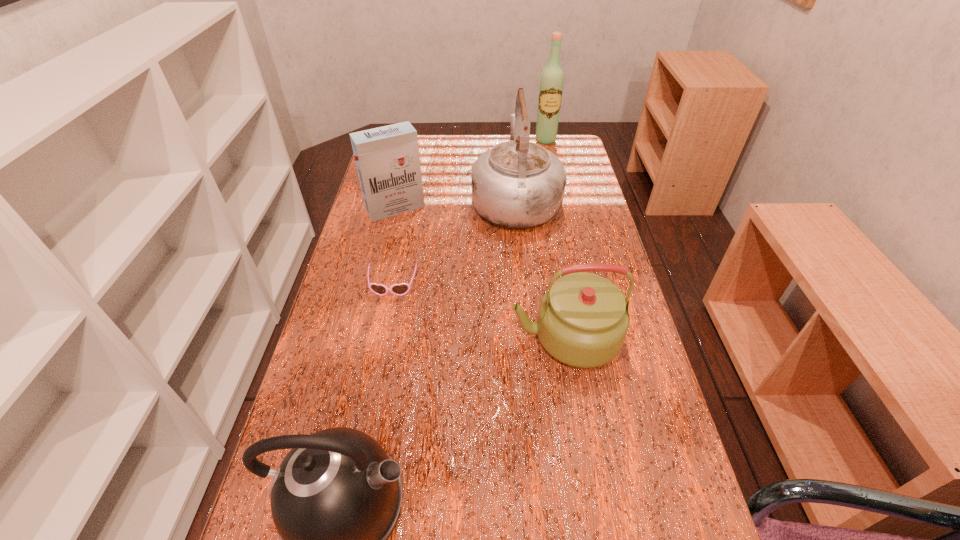
The width and height of the screenshot is (960, 540). Identify the location of wine bottle. (552, 78).

Where is `the tallest kettle`? This screenshot has width=960, height=540. the tallest kettle is located at coordinates (517, 184).

Locate an element on the screen. The width and height of the screenshot is (960, 540). cigarette case is located at coordinates (387, 158).

Locate an element on the screen. The height and width of the screenshot is (540, 960). the second farthest kettle is located at coordinates (583, 319).

What are the coordinates of `sunglasses` in the screenshot? It's located at (401, 289).

Locate an element on the screen. The height and width of the screenshot is (540, 960). the third nearest object is located at coordinates (401, 289).

At what (x,y) coordinates should I click in order to perform the action: click on free point located 0.400m on the front-facing side of the farthest object. Please return your answer as a coordinate pair (x, y). Looking at the image, I should click on (560, 206).

Locate an element on the screen. free space located 0.220m at the spout of the farthest kettle is located at coordinates (510, 141).

The image size is (960, 540). What are the coordinates of `vacant space situated 0.180m at the spout of the farthest kettle` in the screenshot? It's located at (511, 146).

In order to click on free space located at the spout of the farthest kettle in this screenshot , I will do click(511, 154).